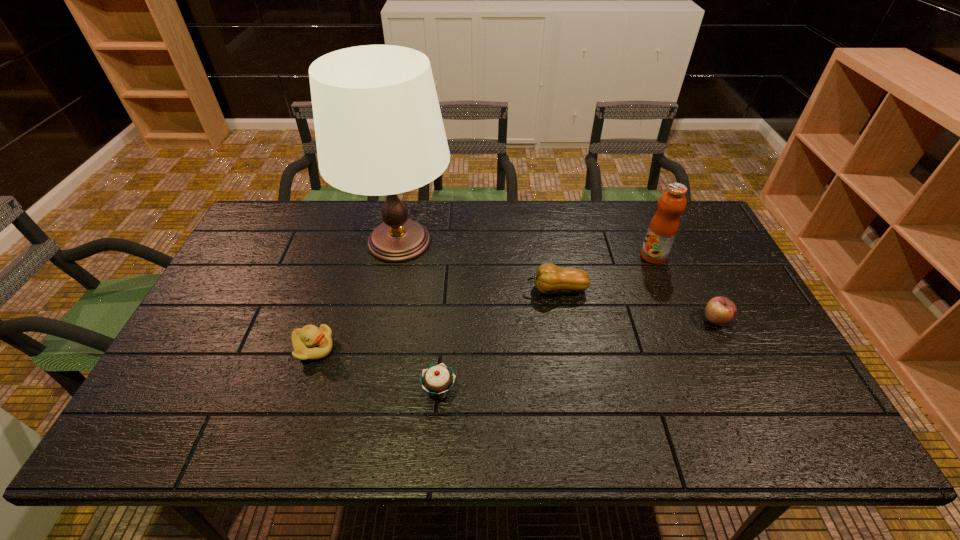
Where is `free region located 0.310m on the front label of the second tallest object`? The image size is (960, 540). free region located 0.310m on the front label of the second tallest object is located at coordinates (543, 256).

Locate an element on the screen. The width and height of the screenshot is (960, 540). vacant space located 0.150m on the front label of the second tallest object is located at coordinates (593, 256).

Image resolution: width=960 pixels, height=540 pixels. I want to click on free space located on the stem side of the fourth object from left to right, so click(x=499, y=290).

I want to click on free spot located on the stem side of the fourth object from left to right, so click(x=418, y=290).

I want to click on vacant region located on the stem side of the fourth object from left to right, so click(418, 290).

In order to click on free space located 0.050m on the left of the apple in this screenshot , I will do `click(684, 321)`.

The image size is (960, 540). Identify the location of vacant space located 0.140m on the beak of the second nearest object. (388, 348).

Locate an element on the screen. Image resolution: width=960 pixels, height=540 pixels. free space located on the back of the cupcake is located at coordinates (447, 279).

I want to click on object that is at the far edge, so tap(379, 131).

The image size is (960, 540). I want to click on object present at the right edge, so coord(720,311).